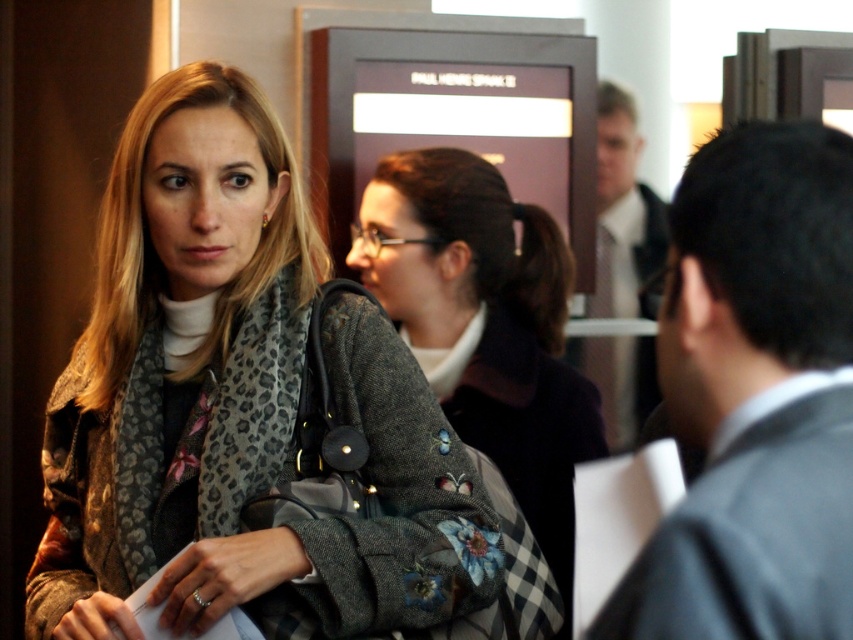
Question: Is gray suit at right below floral tweed coat at center?

Choices:
 (A) yes
 (B) no

Answer: (B)

Question: Which object appears farthest from the camera in this image?

Choices:
 (A) light brown suit at upper right
 (B) gray suit at right
 (C) floral tweed coat at center
 (D) leopard print coat at center

Answer: (A)

Question: Among these points, which one is farthest from the camera?

Choices:
 (A) (181, 152)
 (B) (408, 291)

Answer: (B)

Question: Where is leopard print coat at center located in relation to light brown suit at upper right in the image?

Choices:
 (A) left
 (B) right

Answer: (A)

Question: Observing the image, what is the correct spatial positioning of gray suit at right in reference to light brown suit at upper right?

Choices:
 (A) left
 (B) right

Answer: (A)

Question: Which point is farther from the camera taking this photo?

Choices:
 (A) (614, 312)
 (B) (175, 561)
 (C) (821, 204)
 (D) (509, 454)

Answer: (A)